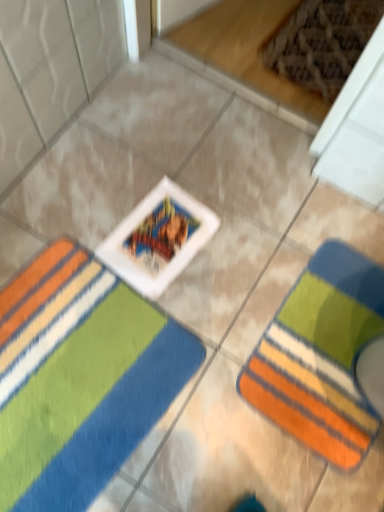
Image resolution: width=384 pixels, height=512 pixels. I want to click on vacant point above multicolored striped towel at lower right, which ranks as the first towel in right-to-left order (from a real-world perspective), so click(334, 351).